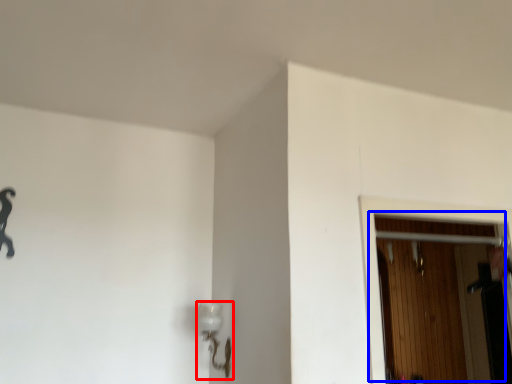
Question: Which object appears farthest to the camera in this image, lamp (highlighted by a red box) or door (highlighted by a blue box)?

Choices:
 (A) lamp
 (B) door

Answer: (A)